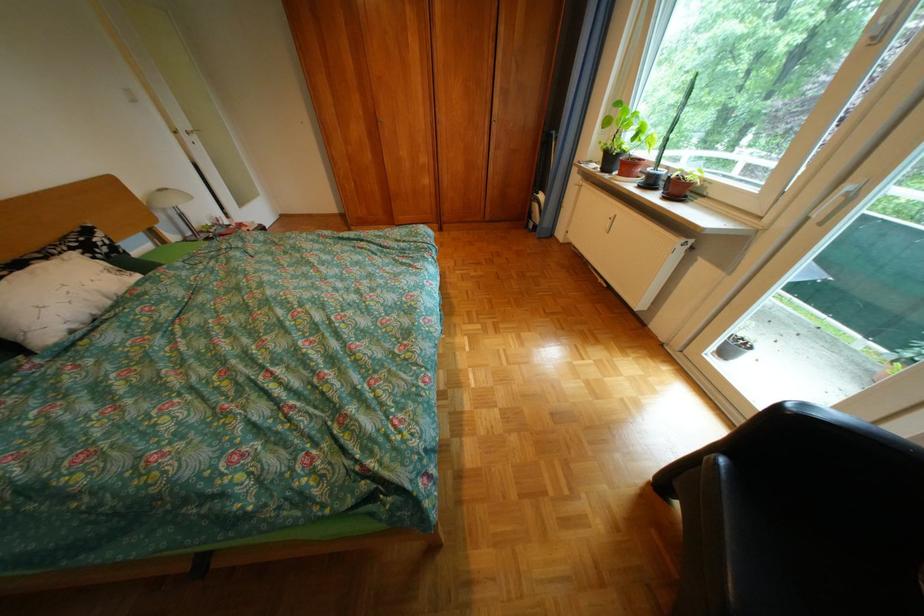
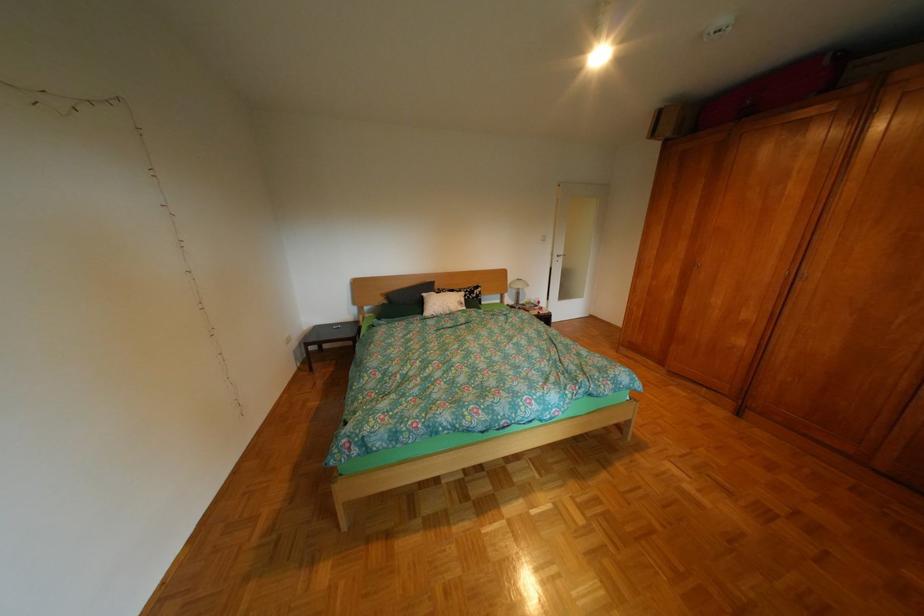
Find the pixel in the second image that matches pixel 169 220 in the first image.

(521, 292)